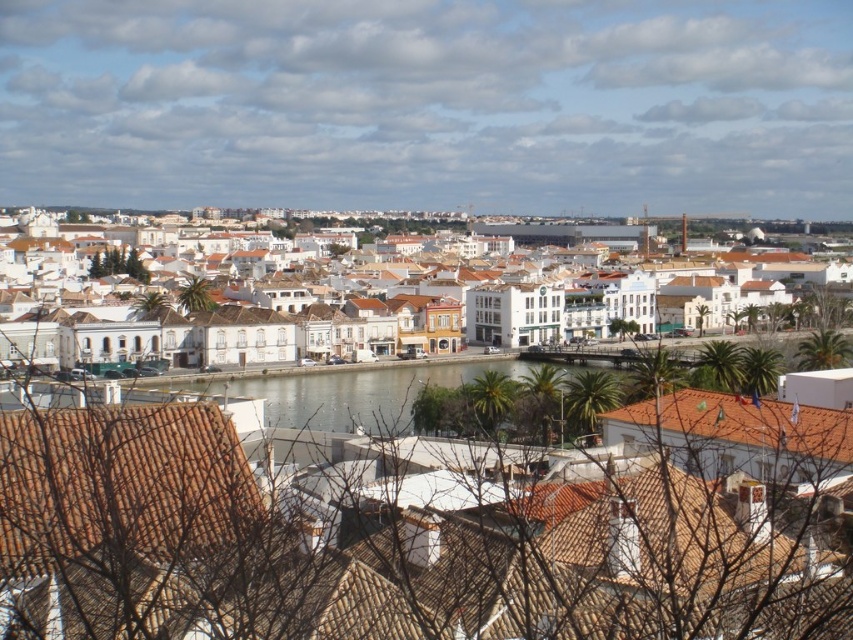
Consider the image. You are a tourist standing at the edge of the water in the coastal town. You want to take a photo that captures both the white stucco buildings at center and the brown tile roof at lower left. Which building should you position closer to the front of the photo to ensure both are visible?

You should position the brown tile roof at lower left closer to the front of the photo because it is shorter than the white stucco buildings at center, ensuring both are visible in the frame.

Looking at this image, you are a tourist standing at the edge of the coastal town. You see the white stucco buildings at center and the brown tile roof at lower right. Which of these two objects is located higher up in the scene?

The white stucco buildings at center are positioned over the brown tile roof at lower right, meaning they are higher up in the scene.

You are a tourist standing in the coastal town and want to take a photo that includes both the white stucco buildings at center and the brown tile roof at lower right. Which object should you position closer to the front of your camera frame to ensure both are visible?

To ensure both the white stucco buildings at center and the brown tile roof at lower right are visible in your photo, position the brown tile roof at lower right closer to the front of your camera frame since it is shorter than the white stucco buildings at center.